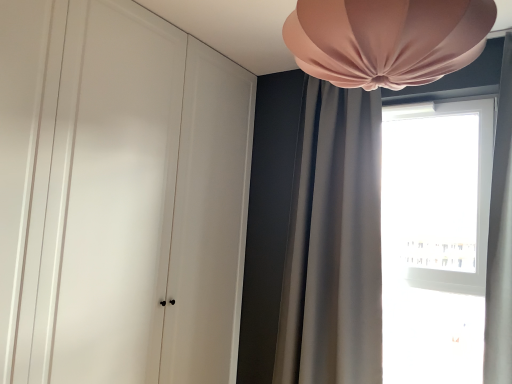
Question: Is point (335, 334) closer or farther from the camera than point (359, 54)?

Choices:
 (A) farther
 (B) closer

Answer: (A)

Question: Considering the relative positions of satin gray curtain at upper right and pink fabric lampshade at upper center in the image provided, is satin gray curtain at upper right to the left or to the right of pink fabric lampshade at upper center?

Choices:
 (A) left
 (B) right

Answer: (B)

Question: Which is farther from the satin gray curtain at upper right?

Choices:
 (A) pink fabric lampshade at upper center
 (B) transparent glass window at right
 (C) matte white wardrobe at left

Answer: (A)

Question: Estimate the real-world distances between objects in this image. Which object is closer to the pink fabric lampshade at upper center?

Choices:
 (A) satin gray curtain at upper right
 (B) matte white wardrobe at left
 (C) transparent glass window at right

Answer: (B)